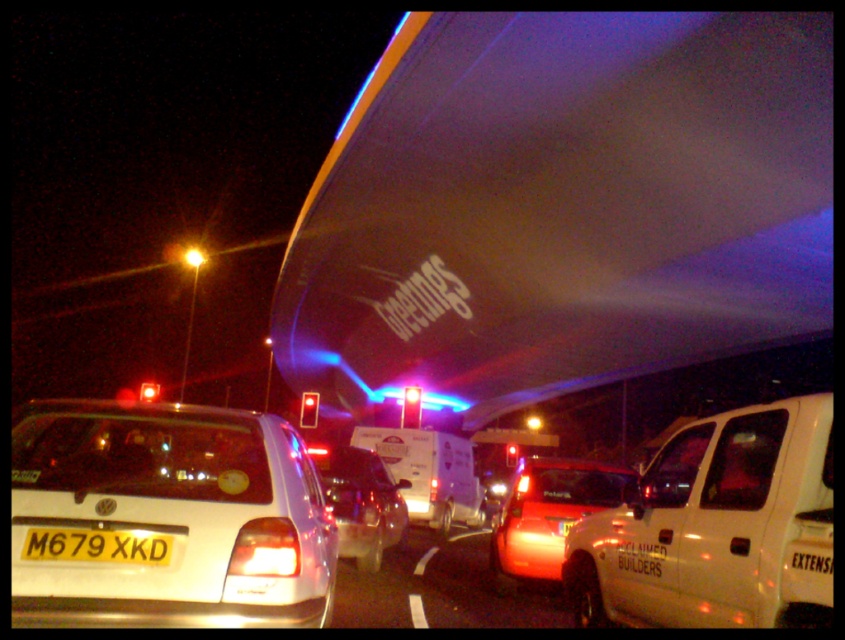
Question: Does matte red car at center appear on the right side of shiny silver sedan at center?

Choices:
 (A) no
 (B) yes

Answer: (B)

Question: Among these objects, which one is farthest from the camera?

Choices:
 (A) white matte hatchback at lower left
 (B) shiny silver sedan at center
 (C) bright yellow light at upper center

Answer: (C)

Question: Which point is closer to the camera?

Choices:
 (A) white matte hatchback at lower left
 (B) white matte van at center-right

Answer: (B)

Question: Is the position of matte red car at center more distant than that of shiny silver sedan at center?

Choices:
 (A) no
 (B) yes

Answer: (A)

Question: Can you confirm if white matte van at center-right is positioned to the left of bright yellow light at upper center?

Choices:
 (A) yes
 (B) no

Answer: (B)

Question: Which object appears closest to the camera in this image?

Choices:
 (A) white matte hatchback at lower left
 (B) shiny silver sedan at center

Answer: (A)